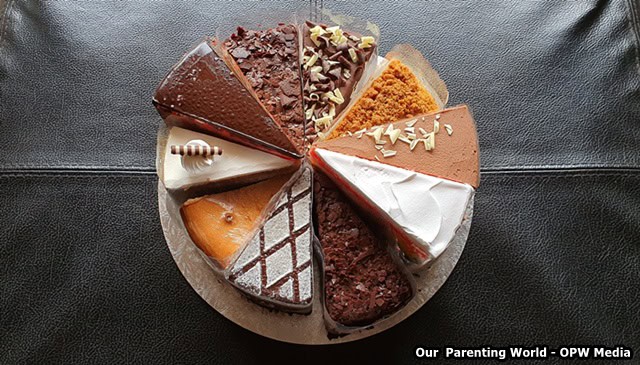
The image size is (640, 365). What are the coordinates of `forks not in image` in the screenshot? It's located at (454, 305), (482, 305), (512, 307), (539, 305), (561, 302), (584, 301), (614, 299), (627, 296), (596, 297), (497, 305).